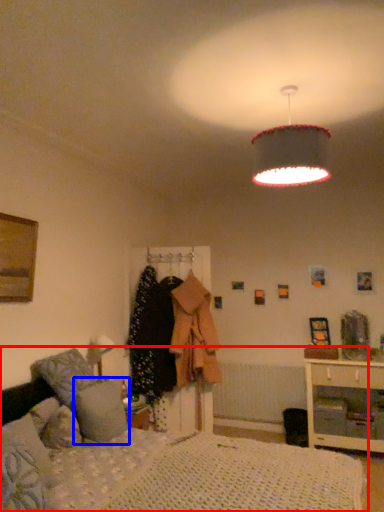
Question: Which point is closer to the camera, bed (highlighted by a red box) or pillow (highlighted by a blue box)?

Choices:
 (A) bed
 (B) pillow

Answer: (A)